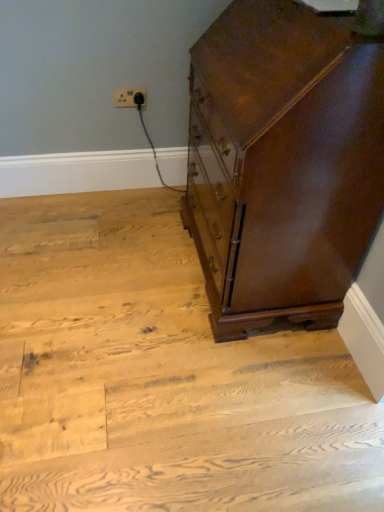
Question: Considering the positions of point (289, 19) and point (119, 105), is point (289, 19) closer or farther from the camera than point (119, 105)?

Choices:
 (A) closer
 (B) farther

Answer: (A)

Question: Considering the positions of shiny brown wood chest of drawers at right and white plastic outlet at upper center in the image, is shiny brown wood chest of drawers at right bigger or smaller than white plastic outlet at upper center?

Choices:
 (A) big
 (B) small

Answer: (A)

Question: Which object is the farthest from the shiny brown wood chest of drawers at right?

Choices:
 (A) white plastic outlet at upper center
 (B) wooden floor at center

Answer: (A)

Question: Estimate the real-world distances between objects in this image. Which object is farther from the wooden floor at center?

Choices:
 (A) white plastic outlet at upper center
 (B) shiny brown wood chest of drawers at right

Answer: (A)